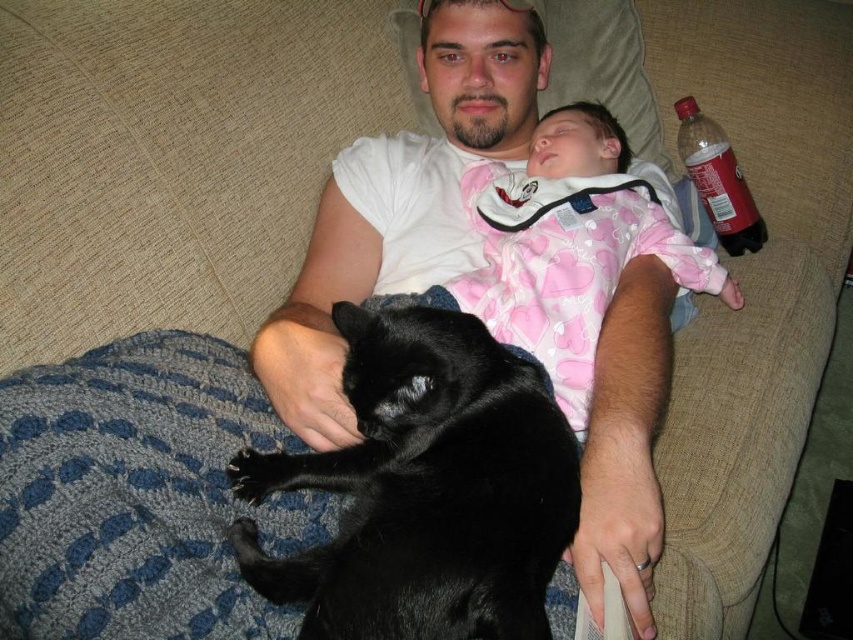
Question: Is shiny black cat at center above pink cotton onesie at upper center?

Choices:
 (A) no
 (B) yes

Answer: (A)

Question: Considering the real-world distances, which object is closest to the pink cotton onesie at upper center?

Choices:
 (A) shiny black cat at center
 (B) red matte soda bottle at upper right

Answer: (B)

Question: Is shiny black cat at center to the right of pink cotton onesie at upper center from the viewer's perspective?

Choices:
 (A) yes
 (B) no

Answer: (B)

Question: Based on their relative distances, which object is farther from the pink cotton onesie at upper center?

Choices:
 (A) red matte soda bottle at upper right
 (B) shiny black cat at center

Answer: (B)

Question: Does pink cotton onesie at upper center have a smaller size compared to red matte soda bottle at upper right?

Choices:
 (A) yes
 (B) no

Answer: (B)

Question: Considering the real-world distances, which object is closest to the red matte soda bottle at upper right?

Choices:
 (A) shiny black cat at center
 (B) pink cotton onesie at upper center

Answer: (B)